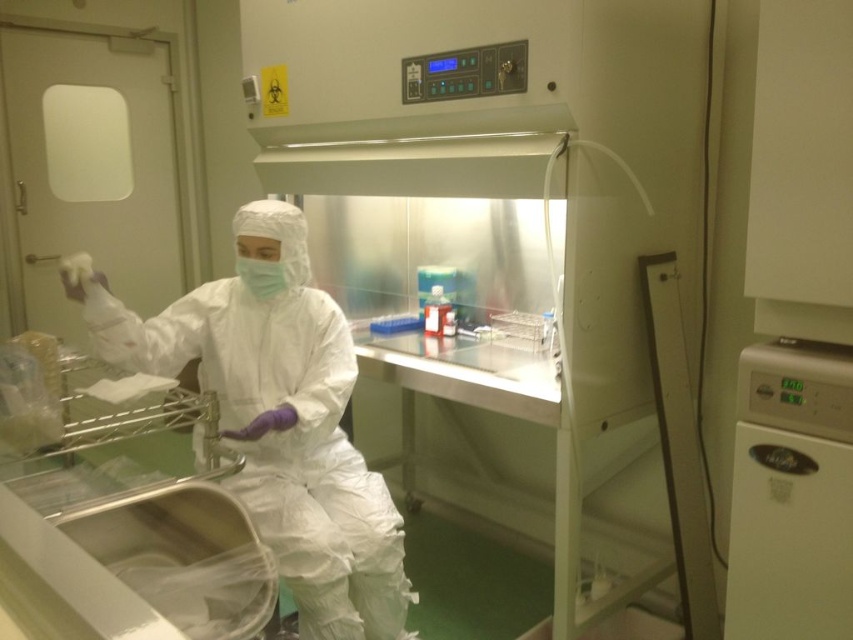
Question: Does white matte/soft fabric at center appear over green matte mask at center?

Choices:
 (A) yes
 (B) no

Answer: (B)

Question: Is white matte/soft fabric at center behind green matte mask at center?

Choices:
 (A) yes
 (B) no

Answer: (B)

Question: Among these objects, which one is farthest from the camera?

Choices:
 (A) green matte mask at center
 (B) white matte/soft fabric at center

Answer: (A)

Question: Does white matte/soft fabric at center have a lesser width compared to green matte mask at center?

Choices:
 (A) yes
 (B) no

Answer: (B)